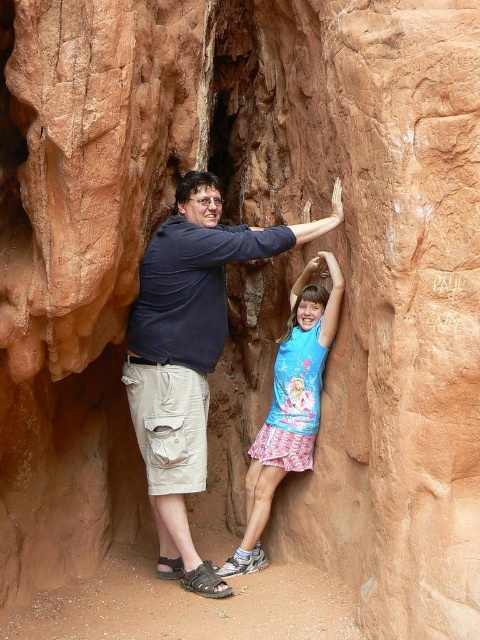
You are navigating a narrow slot canyon and need to pass between two people. One is wearing a matte blue shirt at center. Where is the best spot to pass them?

The best spot to pass the matte blue shirt at center would be to their left or right since they are positioned centrally in the narrow canyon. However, without knowing the exact width of the canyon and the distance between the individuals, it is advisable to communicate and move carefully to ensure safe passage.

You are a photographer trying to capture a photo of both the matte blue shirt at center and the blue printed shirt at center. Since you want both shirts to be visible in the frame, which one should you focus on first to ensure depth of field?

You should focus on the matte blue shirt at center first because it is closer to the camera than the blue printed shirt at center, ensuring both will be in focus with proper depth of field.